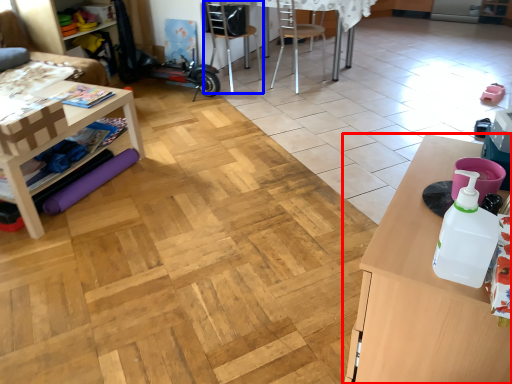
Question: Which point is closer to the camera, table (highlighted by a red box) or chair (highlighted by a blue box)?

Choices:
 (A) table
 (B) chair

Answer: (A)